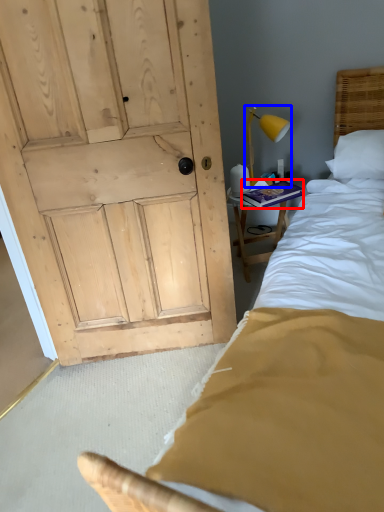
Question: Among these objects, which one is nearest to the camera, book (highlighted by a red box) or bedside lamp (highlighted by a blue box)?

Choices:
 (A) book
 (B) bedside lamp

Answer: (B)